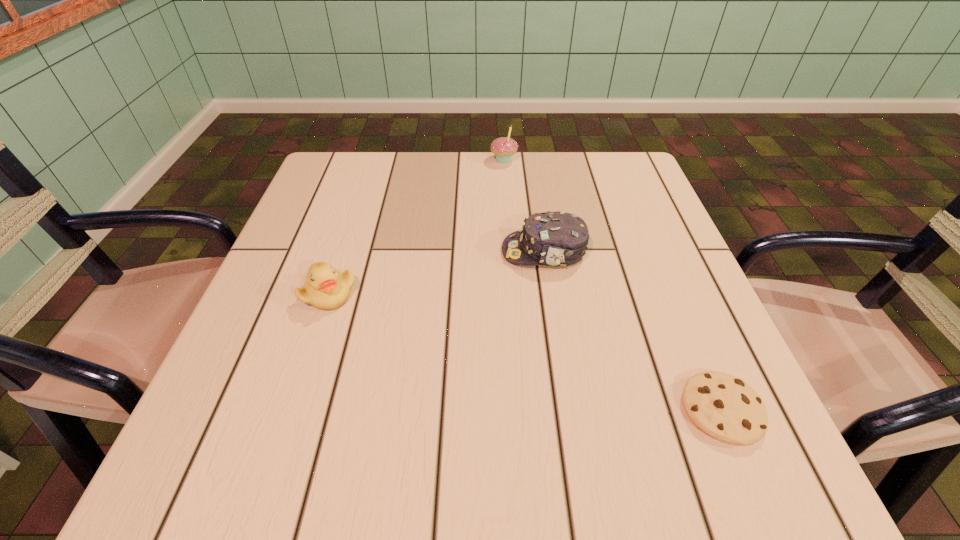
Locate an element on the screen. This screenshot has height=540, width=960. cupcake is located at coordinates (504, 148).

You are a GUI agent. You are given a task and a screenshot of the screen. Output one action in this format:
    pyautogui.click(x=<x>, y=<y>)
    Task: Click on the tallest object
    This screenshot has width=960, height=540.
    Given the screenshot: What is the action you would take?
    pyautogui.click(x=504, y=148)

Find the location of `headwear`. headwear is located at coordinates (557, 238).

Identify the location of duckling. (326, 288).

At what (x,y) coordinates should I click in order to perform the action: click on the leftmost object. Please return your answer as a coordinate pair (x, y). This screenshot has width=960, height=540. Looking at the image, I should click on (326, 288).

Locate an element on the screen. This screenshot has height=540, width=960. the shortest object is located at coordinates (725, 407).

At what (x,y) coordinates should I click in order to perform the action: click on cookie. Please return your answer as a coordinate pair (x, y). Looking at the image, I should click on (725, 407).

This screenshot has height=540, width=960. In order to click on free space located on the left of the farthest object in this screenshot , I will do `click(431, 160)`.

Locate an element on the screen. This screenshot has height=540, width=960. vacant area located 0.350m on the front-facing side of the headwear is located at coordinates (334, 252).

The width and height of the screenshot is (960, 540). I want to click on vacant region located on the front-facing side of the headwear, so click(387, 252).